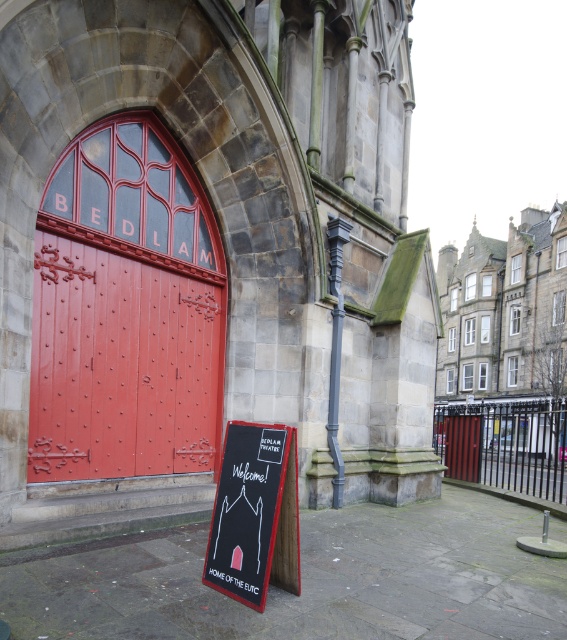
You are standing in front of the building and want to read the black cardboard sign at center. Which direction should you turn to face the sign while keeping the stone church at center in your view?

The stone church at center is to the right of the black cardboard sign at center, so you should turn to your left to face the sign while still seeing the church to your right.

You are standing in front of the building and want to locate the dark gray stone church at center. Where would you look?

The dark gray stone church at center is located at the coordinates point (x=505, y=310).

You are standing in front of the building and want to take a photo of the stone church at center. Where should you position yourself to capture it in the frame?

The stone church at center is located at point (205, 253), so you should position yourself directly in front of it to ensure it is centered in your photo.